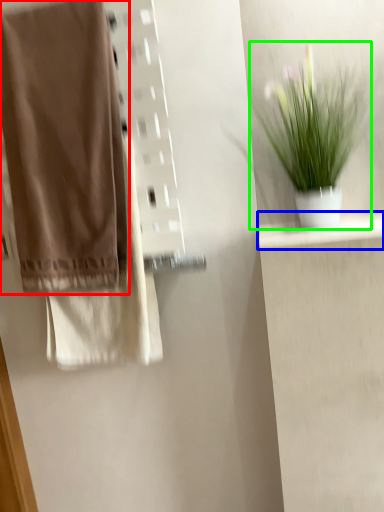
Question: Estimate the real-world distances between objects in this image. Which object is farther from towel (highlighted by a red box), shelf (highlighted by a blue box) or houseplant (highlighted by a green box)?

Choices:
 (A) shelf
 (B) houseplant

Answer: (A)